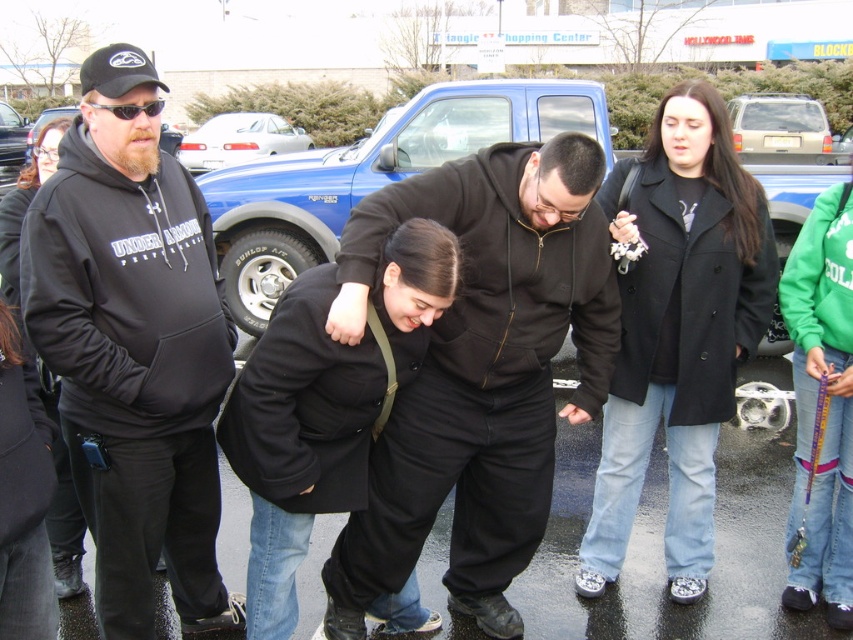
You are a fashion designer analyzing the outfits in the image. You need to determine which clothing item is wider between the black matte hoodie at center and the black matte coat at center. Which one is wider?

The black matte hoodie at center is wider than the black matte coat at center according to the description.

Looking at this image, you are organizing a charity clothing drive and need to determine if two hoodies can fit side by side on a 1.2 meter wide display shelf. The hoodies are the black matte hoodie at center and the black hoodie at left. Based on their widths, will they fit together on the shelf?

The black matte hoodie at center might be wider than the black hoodie at left. If the combined width of both hoodies does not exceed 1.2 meters, they can fit. However, since the exact widths are not provided, it is uncertain whether they will fit together on the shelf.

You are a photographer trying to capture a photo of the gold metallic suv at upper right without including the black wool coat at center in the frame. Given their relative sizes in the image, is this possible?

The black wool coat at center is much taller than the gold metallic suv at upper right, so it might block the view of the suv. However, since the suv is at upper right and the coat is at center, adjusting the camera angle downward could exclude the coat while focusing on the suv.